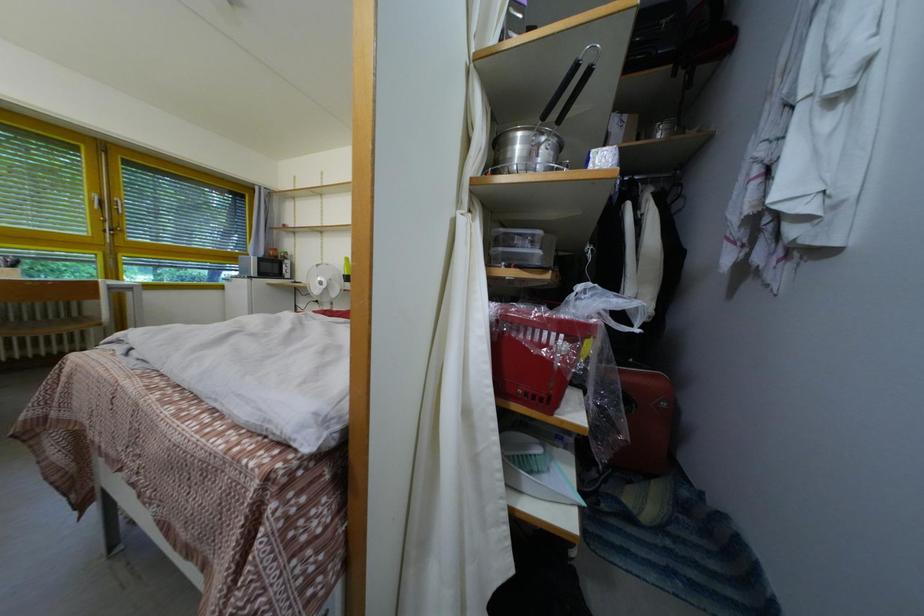
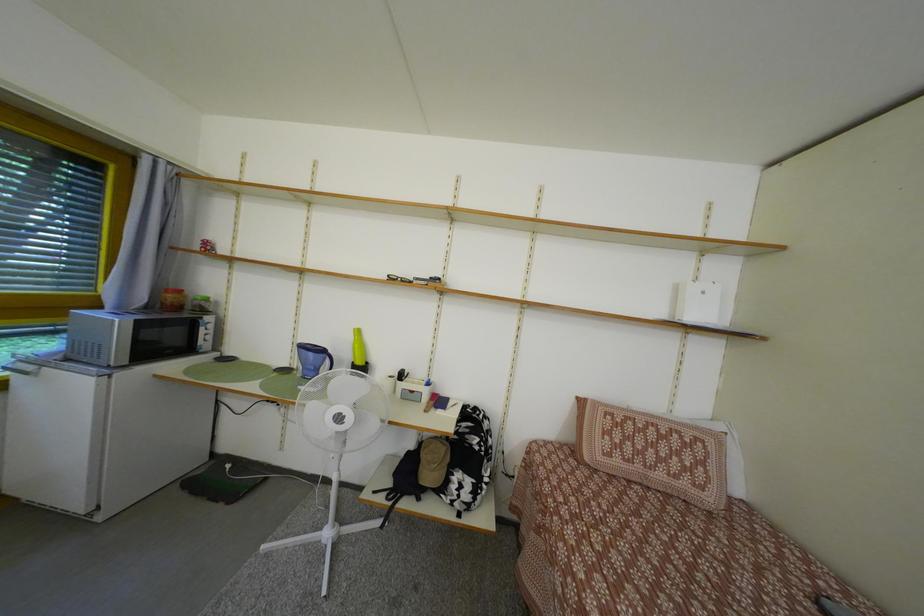
Consider the image. The images are taken continuously from a first-person perspective. In which direction are you moving?

The movement direction of the cameraman is left, forward.